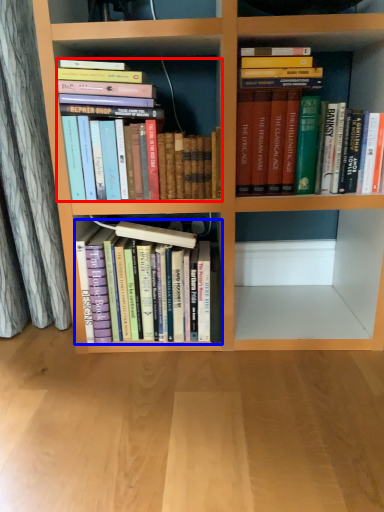
Question: Which object is closer to the camera taking this photo, book (highlighted by a red box) or book (highlighted by a blue box)?

Choices:
 (A) book
 (B) book

Answer: (A)